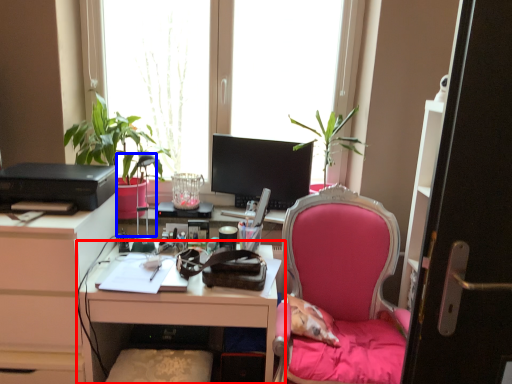
Question: Which point is closer to the camera, desk (highlighted by a red box) or lamp (highlighted by a blue box)?

Choices:
 (A) desk
 (B) lamp

Answer: (A)